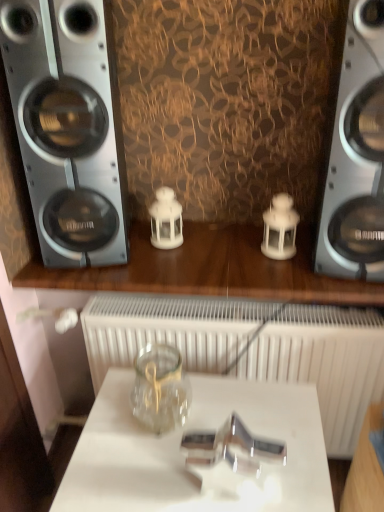
The width and height of the screenshot is (384, 512). Find the location of `unoccupied area in front of transparent glass jar at center`. unoccupied area in front of transparent glass jar at center is located at coordinates (134, 471).